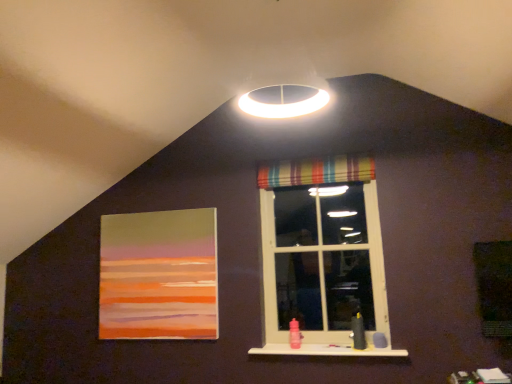
Question: Is matte acrylic painting at left a part of striped fabric window at center?

Choices:
 (A) no
 (B) yes

Answer: (A)

Question: Can you confirm if striped fabric window at center is shorter than matte acrylic painting at left?

Choices:
 (A) yes
 (B) no

Answer: (B)

Question: Is striped fabric window at center outside matte acrylic painting at left?

Choices:
 (A) no
 (B) yes

Answer: (B)

Question: Is striped fabric window at center looking in the opposite direction of matte acrylic painting at left?

Choices:
 (A) no
 (B) yes

Answer: (A)

Question: Is striped fabric window at center thinner than matte acrylic painting at left?

Choices:
 (A) yes
 (B) no

Answer: (B)

Question: From a real-world perspective, is matte acrylic painting at left physically located above or below white matte window sill at lower center?

Choices:
 (A) above
 (B) below

Answer: (A)

Question: Is point click(x=121, y=248) closer or farther from the camera than point click(x=367, y=347)?

Choices:
 (A) farther
 (B) closer

Answer: (A)

Question: In the image, is matte acrylic painting at left positioned in front of or behind white matte window sill at lower center?

Choices:
 (A) behind
 (B) front

Answer: (A)

Question: From the image's perspective, is matte acrylic painting at left above or below white matte window sill at lower center?

Choices:
 (A) below
 (B) above

Answer: (B)

Question: Is matte acrylic painting at left wider or thinner than striped fabric window at center?

Choices:
 (A) thin
 (B) wide

Answer: (A)

Question: Relative to striped fabric window at center, is matte acrylic painting at left in front or behind?

Choices:
 (A) front
 (B) behind

Answer: (B)

Question: From their relative heights in the image, would you say matte acrylic painting at left is taller or shorter than striped fabric window at center?

Choices:
 (A) tall
 (B) short

Answer: (B)

Question: Based on their positions, is matte acrylic painting at left located to the left or right of striped fabric window at center?

Choices:
 (A) left
 (B) right

Answer: (A)

Question: Is point (276, 264) positioned closer to the camera than point (271, 177)?

Choices:
 (A) closer
 (B) farther

Answer: (A)

Question: From the image's perspective, is striped fabric window at center positioned above or below striped fabric curtain at upper center?

Choices:
 (A) below
 (B) above

Answer: (A)